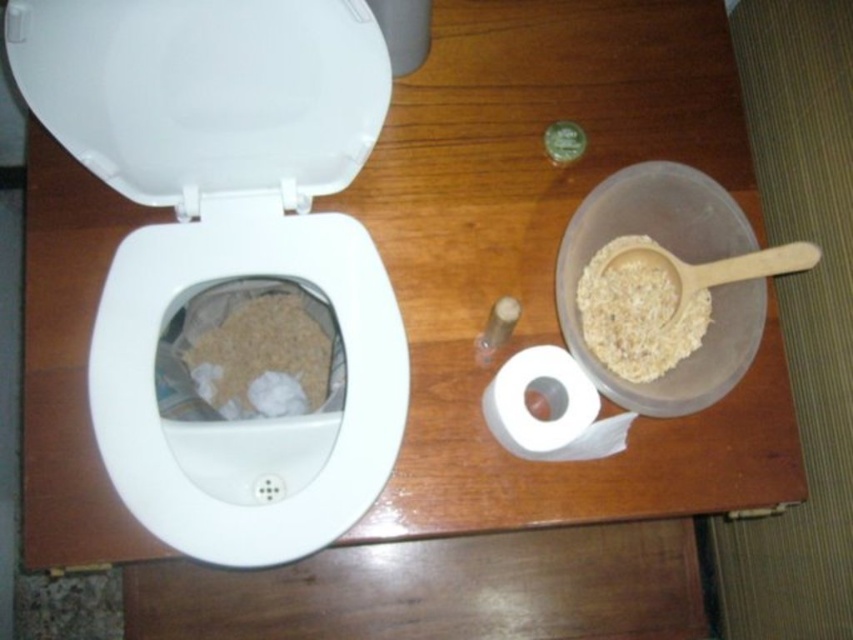
Question: Can you confirm if white plastic toilet lid at upper left is smaller than translucent plastic bowl at upper right?

Choices:
 (A) yes
 (B) no

Answer: (B)

Question: Which object is closer to the camera taking this photo?

Choices:
 (A) translucent plastic bowl at upper right
 (B) brown matte cereal at upper right

Answer: (A)

Question: Does brown matte cereal at upper right appear on the right side of white matte toilet paper at lower right?

Choices:
 (A) yes
 (B) no

Answer: (A)

Question: Is white glossy toilet bowl at left further to camera compared to brown grainy cereal at toilet bowl?

Choices:
 (A) yes
 (B) no

Answer: (B)

Question: Among these objects, which one is nearest to the camera?

Choices:
 (A) translucent plastic bowl at upper right
 (B) white glossy toilet bowl at left
 (C) white matte toilet paper at lower right
 (D) white plastic toilet lid at upper left

Answer: (D)

Question: Which object is closer to the camera taking this photo?

Choices:
 (A) white matte toilet paper at lower right
 (B) white plastic toilet lid at upper left
 (C) translucent plastic bowl at upper right

Answer: (B)